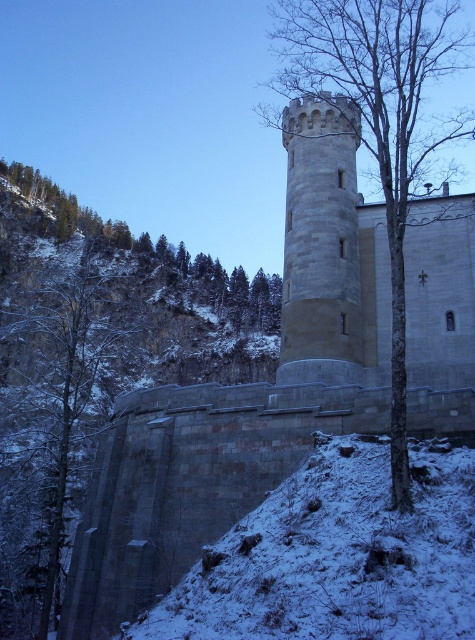
Is bare wood tree at center smaller than light gray stone tower at center?

No.

What do you see at coordinates (377, 122) in the screenshot?
I see `bare wood tree at center` at bounding box center [377, 122].

Identify the location of bare wood tree at center. (377, 122).

Who is shorter, snowy bark tree at left or light gray stone tower at center?

light gray stone tower at center

Who is lower down, snowy bark tree at left or light gray stone tower at center?

snowy bark tree at left is lower down.

Is point (62, 355) farther from viewer compared to point (351, 170)?

Yes, it is behind point (351, 170).

At what (x,y) coordinates should I click in order to perform the action: click on snowy bark tree at left. Please return your answer as a coordinate pair (x, y). This screenshot has height=640, width=475. Looking at the image, I should click on (58, 406).

Locate an element on the screen. snowy bark tree at left is located at coordinates (58, 406).

Does snowy bark tree at left have a smaller size compared to bare wood tree at center?

Yes.

Is point (15, 412) positioned behind point (425, 28)?

No, it is not.

Where is `snowy bark tree at left`? This screenshot has height=640, width=475. snowy bark tree at left is located at coordinates (58, 406).